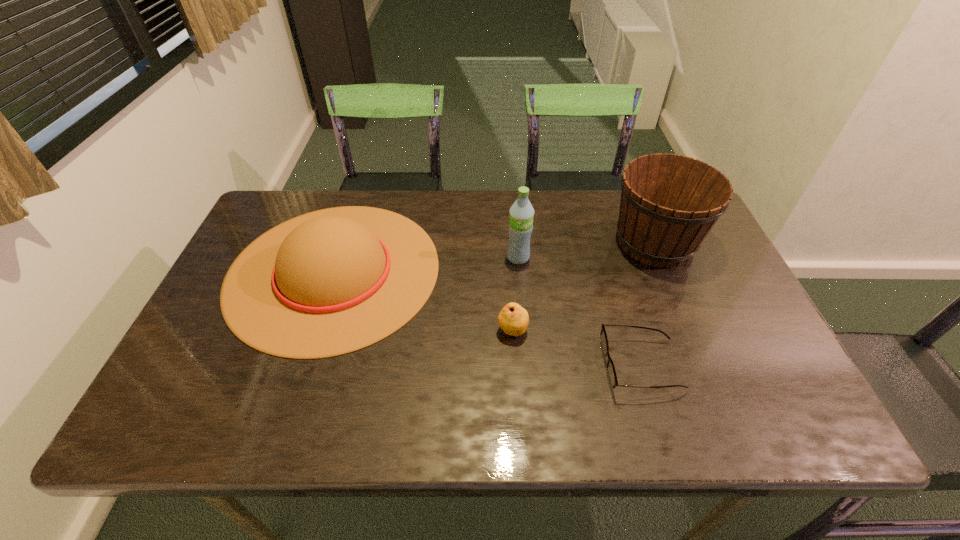
What are the coordinates of `free point located 0.150m on the face of the spectacles` in the screenshot? It's located at (538, 366).

You are a GUI agent. You are given a task and a screenshot of the screen. Output one action in this format:
    pyautogui.click(x=<x>, y=<y>)
    Task: Click on the vacant area situated on the face of the spectacles
    
    Given the screenshot: What is the action you would take?
    pyautogui.click(x=525, y=366)

Identify the location of free space located on the face of the spectacles. (485, 366).

Locate an element on the screen. The height and width of the screenshot is (540, 960). wine bucket present at the far edge is located at coordinates 669,203.

Identify the location of sombrero positioned at the far edge. Image resolution: width=960 pixels, height=540 pixels. (330, 282).

You are a GUI agent. You are given a task and a screenshot of the screen. Output one action in this format:
    pyautogui.click(x=<x>, y=<y>)
    Task: Click on the object present at the near edge
    This screenshot has height=540, width=960.
    Given the screenshot: What is the action you would take?
    (611, 372)

Find the location of a particular element. object positioned at the left edge is located at coordinates (330, 282).

Where is `object present at the right edge`? object present at the right edge is located at coordinates (669, 203).

At what (x,y) coordinates should I click in order to perform the action: click on object that is at the far left corner. Please return your answer as a coordinate pair (x, y). Looking at the image, I should click on (330, 282).

The image size is (960, 540). In order to click on object at the far right corner in this screenshot , I will do `click(669, 203)`.